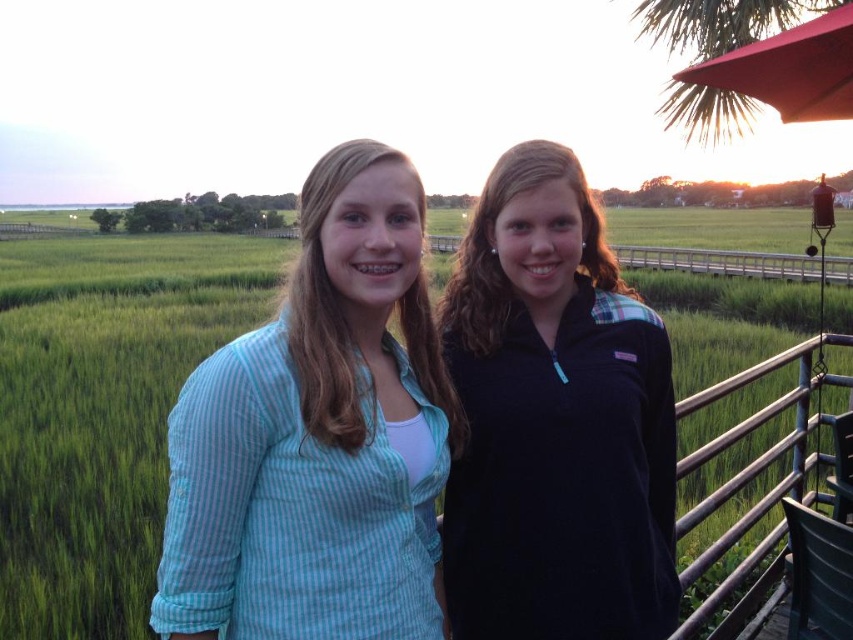
You are a photographer aiming to capture the two people in the scene. The light blue striped shirt at center and the dark blue fleece at center are both visible. Which clothing item is positioned higher on the person?

The light blue striped shirt at center is above the dark blue fleece at center, so the light blue striped shirt at center is positioned higher.

You are a photographer trying to capture both the dark blue fleece at center and the metallic silver railing at right in a single shot. Which object should you focus on first to ensure both are in sharp focus?

You should focus on the dark blue fleece at center first because it is closer to the viewer than the metallic silver railing at right. By focusing on the closer object, the depth of field may extend to include the distant railing in acceptable focus.

From the picture: You are a photographer trying to capture both the light blue striped shirt at center and the dark blue fleece at center in a single frame. Since you want to emphasize the size difference between them, which one should you zoom in on more to make the size difference more apparent?

To emphasize the size difference between the light blue striped shirt at center and the dark blue fleece at center, you should zoom in more on the light blue striped shirt at center, as it is smaller and requires closer focus to highlight its size relative to the larger dark blue fleece at center.